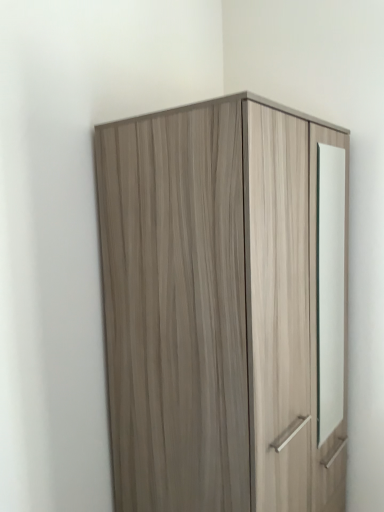
Identify the location of light brown wood wardrobe at center. This screenshot has width=384, height=512. (222, 308).

The height and width of the screenshot is (512, 384). What do you see at coordinates (222, 308) in the screenshot?
I see `light brown wood wardrobe at center` at bounding box center [222, 308].

Where is `light brown wood wardrobe at center`? The height and width of the screenshot is (512, 384). light brown wood wardrobe at center is located at coordinates (222, 308).